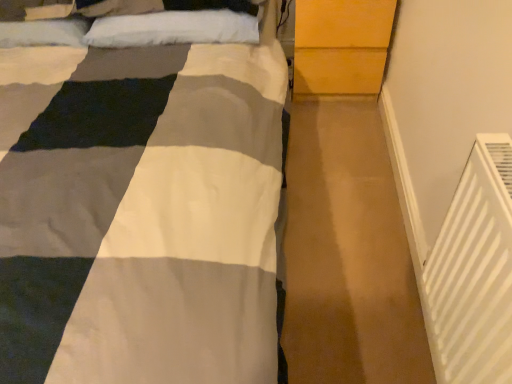
Question: Choose the correct answer: Is white plastic radiator at lower right inside light brown wood dresser at upper right or outside it?

Choices:
 (A) inside
 (B) outside

Answer: (B)

Question: In the image, is white plastic radiator at lower right positioned in front of or behind light brown wood dresser at upper right?

Choices:
 (A) front
 (B) behind

Answer: (A)

Question: Which object is the closest to the white fluffy pillow at upper center?

Choices:
 (A) light brown wood dresser at upper right
 (B) white plastic radiator at lower right

Answer: (A)

Question: Estimate the real-world distances between objects in this image. Which object is farther from the light brown wood dresser at upper right?

Choices:
 (A) white fluffy pillow at upper center
 (B) white plastic radiator at lower right

Answer: (B)